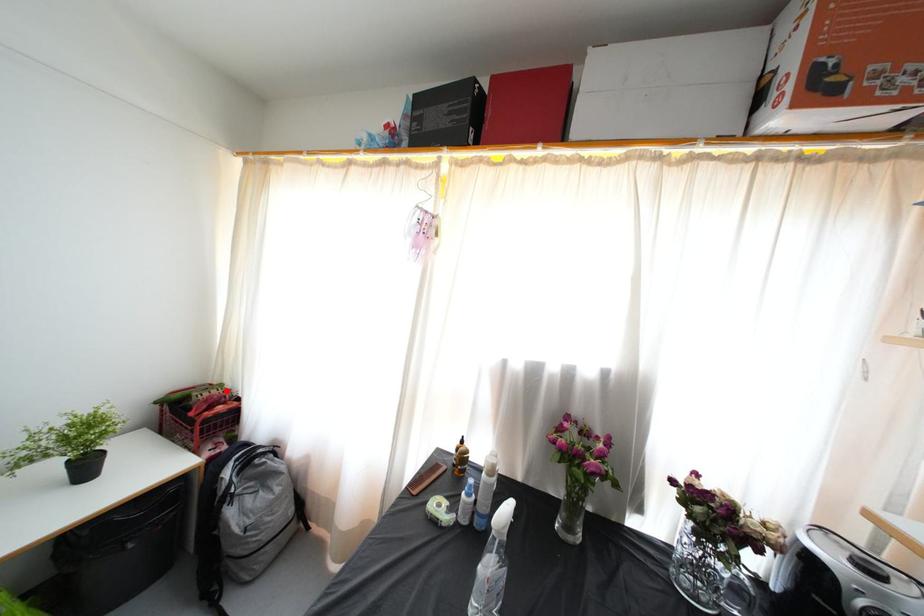
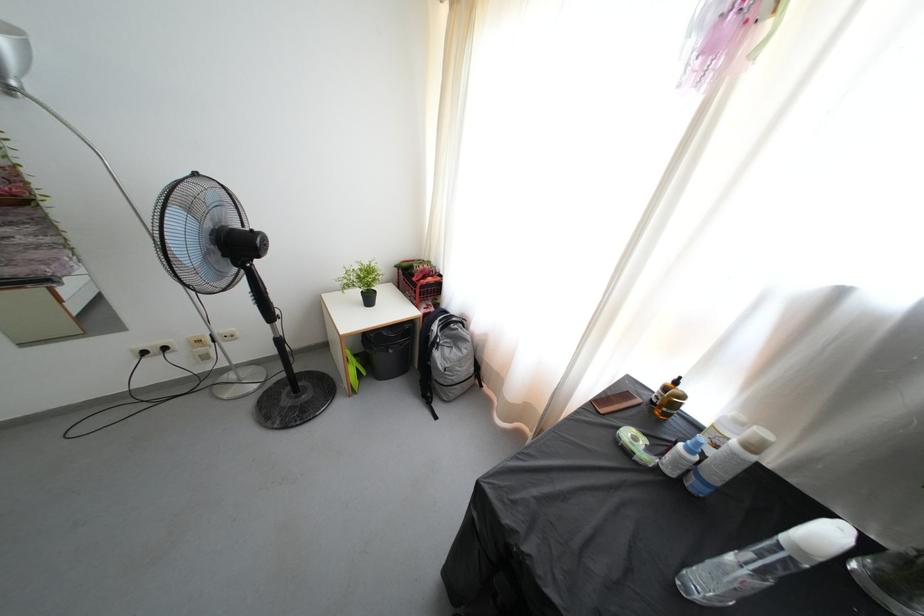
Where in the second image is the point corresponding to the highlighted location from the first image?

(434, 268)